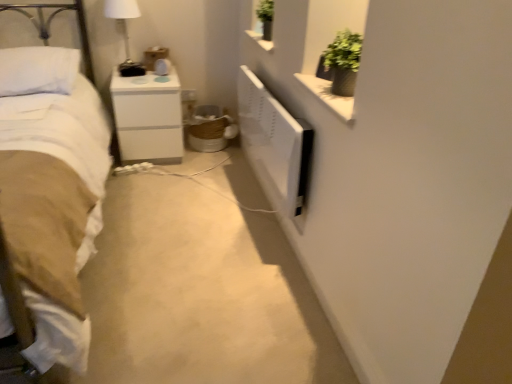
What do you see at coordinates (38, 70) in the screenshot? I see `white soft pillow at upper left` at bounding box center [38, 70].

I want to click on white glossy lampshade at upper left, so click(125, 32).

I want to click on white soft pillow at upper left, so click(38, 70).

Is white glossy lampshade at upper left looking in the opposite direction of white glossy nightstand at center?

That's not correct — white glossy lampshade at upper left is not looking away from white glossy nightstand at center.

Is white glossy lampshade at upper left taller or shorter than white glossy nightstand at center?

Clearly, white glossy lampshade at upper left is shorter compared to white glossy nightstand at center.

Can you confirm if white glossy lampshade at upper left is positioned to the right of white glossy nightstand at center?

No.

Considering the sizes of objects white glossy lampshade at upper left and white glossy nightstand at center in the image provided, who is smaller, white glossy lampshade at upper left or white glossy nightstand at center?

white glossy lampshade at upper left is smaller.

Considering the relative sizes of white soft pillow at upper left and white glossy nightstand at center in the image provided, is white soft pillow at upper left wider than white glossy nightstand at center?

In fact, white soft pillow at upper left might be narrower than white glossy nightstand at center.

Locate an element on the screen. nightstand below the white soft pillow at upper left (from a real-world perspective) is located at coordinates (148, 117).

From the image's perspective, who appears lower, white soft pillow at upper left or white glossy nightstand at center?

white glossy nightstand at center appears lower in the image.

From a real-world perspective, is white soft pillow at upper left on white glossy nightstand at center?

Yes, from a real-world perspective, white soft pillow at upper left is on top of white glossy nightstand at center.

From the image's perspective, is white soft pillow at upper left located above white soft bed at left?

Correct, white soft pillow at upper left appears higher than white soft bed at left in the image.

Visually, is white soft pillow at upper left positioned to the left or to the right of white soft bed at left?

In the image, white soft pillow at upper left appears on the left side of white soft bed at left.

Is white soft pillow at upper left taller than white soft bed at left?

Incorrect, the height of white soft pillow at upper left is not larger of that of white soft bed at left.

What's the angular difference between white soft pillow at upper left and white soft bed at left's facing directions?

The angular difference between white soft pillow at upper left and white soft bed at left is 2.08 degrees.

Is white soft pillow at upper left at the back of white soft bed at left?

That's right, white soft bed at left is facing away from white soft pillow at upper left.

From the image's perspective, between white soft bed at left and white soft pillow at upper left, who is located below?

white soft bed at left appears lower in the image.

Can you confirm if white soft bed at left is taller than white soft pillow at upper left?

Yes.

Is white soft bed at left thinner than white soft pillow at upper left?

Incorrect, the width of white soft bed at left is not less than that of white soft pillow at upper left.

The width and height of the screenshot is (512, 384). In order to click on bedside lamp above the white soft bed at left (from a real-world perspective) in this screenshot , I will do `click(125, 32)`.

From a real-world perspective, relative to white soft bed at left, is white glossy lampshade at upper left vertically above or below?

white glossy lampshade at upper left is situated higher than white soft bed at left in the real world.

From the image's perspective, which object appears higher, white glossy lampshade at upper left or white soft bed at left?

white glossy lampshade at upper left appears higher in the image.

Does white glossy nightstand at center contain white soft bed at left?

No, white soft bed at left is not inside white glossy nightstand at center.

In terms of width, does white glossy nightstand at center look wider or thinner when compared to white soft bed at left?

In the image, white glossy nightstand at center appears to be more narrow than white soft bed at left.

From a real-world perspective, who is located higher, white glossy nightstand at center or white soft bed at left?

white soft bed at left.

Does white glossy nightstand at center have a lesser height compared to white soft bed at left?

Yes.

This screenshot has height=384, width=512. There is a white glossy nightstand at center. Identify the location of pillow above it (from a real-world perspective). (38, 70).

Is white glossy nightstand at center outside of white soft pillow at upper left?

Yes, white glossy nightstand at center is not within white soft pillow at upper left.

Considering the relative sizes of white glossy nightstand at center and white soft pillow at upper left in the image provided, is white glossy nightstand at center smaller than white soft pillow at upper left?

No, white glossy nightstand at center is not smaller than white soft pillow at upper left.

From the image's perspective, between white glossy nightstand at center and white soft pillow at upper left, who is located below?

From the image's view, white glossy nightstand at center is below.

At what (x,y) coordinates should I click in order to perform the action: click on nightstand below the white glossy lampshade at upper left (from a real-world perspective). Please return your answer as a coordinate pair (x, y). The width and height of the screenshot is (512, 384). Looking at the image, I should click on (148, 117).

The width and height of the screenshot is (512, 384). I want to click on nightstand that appears on the right of white soft pillow at upper left, so click(148, 117).

From the image, which object appears to be farther from white glossy lampshade at upper left, white soft bed at left or white glossy nightstand at center?

white soft bed at left is positioned further to the anchor white glossy lampshade at upper left.

Which object lies further to the anchor point white glossy nightstand at center, white soft bed at left or white soft pillow at upper left?

white soft bed at left.

Based on their spatial positions, is white glossy lampshade at upper left or white glossy nightstand at center further from white soft pillow at upper left?

The object further to white soft pillow at upper left is white glossy lampshade at upper left.

Consider the image. From the image, which object appears to be nearer to white glossy nightstand at center, white soft bed at left or white glossy lampshade at upper left?

white glossy lampshade at upper left is positioned closer to the anchor white glossy nightstand at center.

From the image, which object appears to be farther from white glossy lampshade at upper left, white glossy nightstand at center or white soft bed at left?

Among the two, white soft bed at left is located further to white glossy lampshade at upper left.

Estimate the real-world distances between objects in this image. Which object is further from white soft bed at left, white glossy lampshade at upper left or white soft pillow at upper left?

white glossy lampshade at upper left.

Estimate the real-world distances between objects in this image. Which object is further from white glossy nightstand at center, white glossy lampshade at upper left or white soft bed at left?

Among the two, white soft bed at left is located further to white glossy nightstand at center.

Based on their spatial positions, is white glossy nightstand at center or white glossy lampshade at upper left closer to white soft pillow at upper left?

Based on the image, white glossy nightstand at center appears to be nearer to white soft pillow at upper left.

Locate an element on the screen. This screenshot has width=512, height=384. bedside lamp between white soft bed at left and white glossy nightstand at center from front to back is located at coordinates (125, 32).

Where is `bedside lamp between white soft pillow at upper left and white glossy nightstand at center`? Image resolution: width=512 pixels, height=384 pixels. bedside lamp between white soft pillow at upper left and white glossy nightstand at center is located at coordinates (125, 32).

The height and width of the screenshot is (384, 512). In order to click on pillow located between white soft bed at left and white glossy lampshade at upper left in the depth direction in this screenshot , I will do [38, 70].

Locate an element on the screen. Image resolution: width=512 pixels, height=384 pixels. pillow between white soft bed at left and white glossy nightstand at center from front to back is located at coordinates (38, 70).